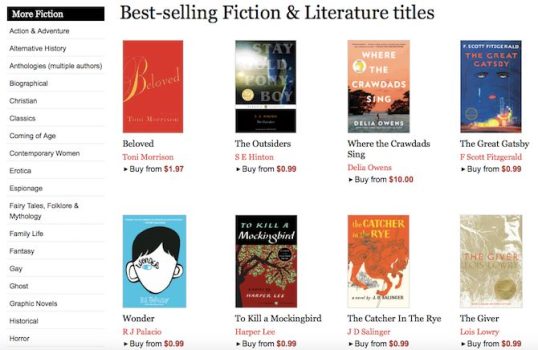
Where is `books`? books is located at coordinates (502, 97), (371, 93), (272, 99), (150, 112), (146, 229), (269, 251), (372, 255), (462, 255).